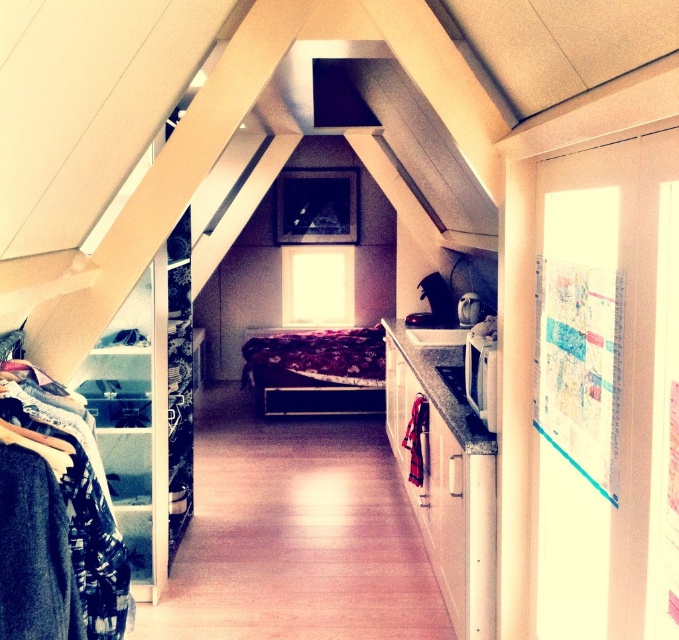
Who is shorter, flannel shirt at left or dark blue wool sweater at left?

Standing shorter between the two is dark blue wool sweater at left.

The width and height of the screenshot is (679, 640). I want to click on flannel shirt at left, so click(75, 496).

Is flannel shirt at left positioned in front of floral-patterned fabric bed at center?

Yes, flannel shirt at left is in front of floral-patterned fabric bed at center.

Does flannel shirt at left have a lesser width compared to floral-patterned fabric bed at center?

Yes.

Who is more forward, (100, 595) or (340, 380)?

Point (100, 595) is in front.

Identify the location of flannel shirt at left. (75, 496).

Can you confirm if dark blue wool sweater at left is smaller than floral-patterned fabric bed at center?

Yes, dark blue wool sweater at left is smaller than floral-patterned fabric bed at center.

Can you confirm if dark blue wool sweater at left is positioned below floral-patterned fabric bed at center?

Yes.

Is point (24, 580) closer to viewer compared to point (308, 380)?

That is True.

Locate an element on the screen. dark blue wool sweater at left is located at coordinates (35, 552).